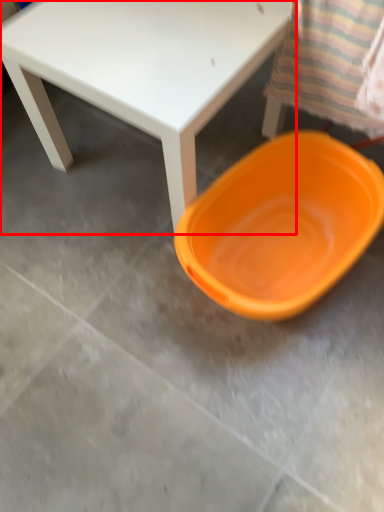
Question: Observing the image, what is the correct spatial positioning of table (annotated by the red box) in reference to plate?

Choices:
 (A) left
 (B) right

Answer: (A)